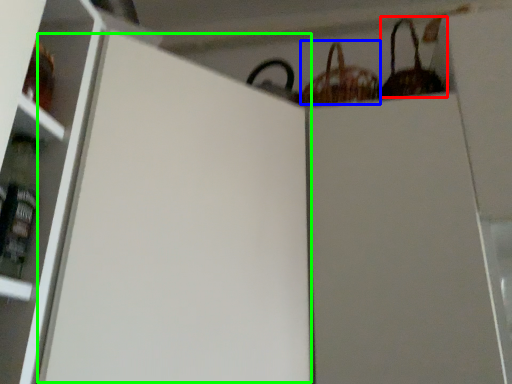
Question: Which object is the closest to the basket (highlighted by a red box)? Choose among these: basket (highlighted by a blue box) or screen door (highlighted by a green box).

Choices:
 (A) basket
 (B) screen door

Answer: (A)